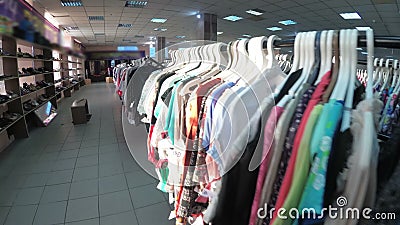
I want to click on mirror, so click(49, 109).